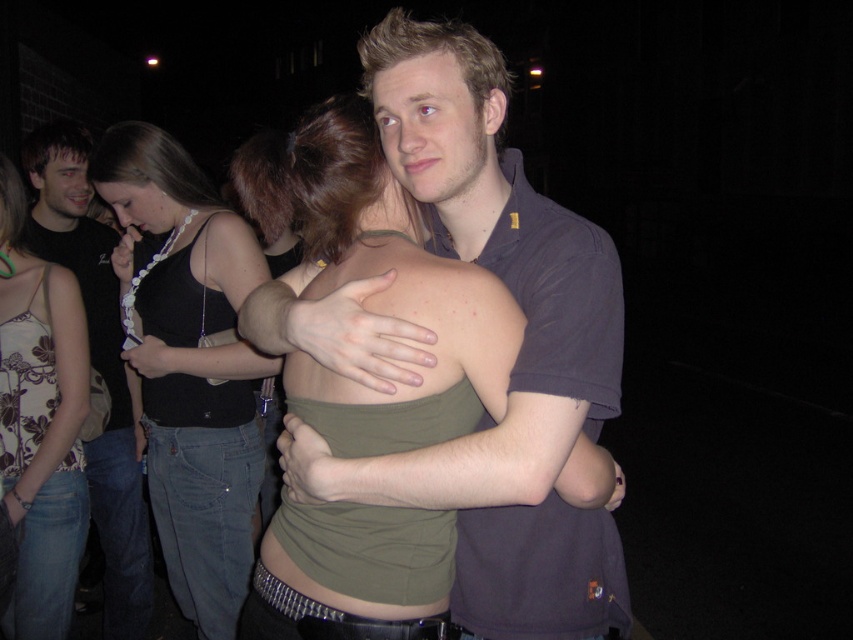
Question: From the image, what is the correct spatial relationship of floral print tank top at left in relation to matte black tank top at left?

Choices:
 (A) above
 (B) below

Answer: (A)

Question: Can you confirm if black fabric top at upper left is thinner than matte black tank top at left?

Choices:
 (A) no
 (B) yes

Answer: (A)

Question: Is floral print tank top at left thinner than matte black tank top at left?

Choices:
 (A) no
 (B) yes

Answer: (B)

Question: Which point is farther to the camera?

Choices:
 (A) (54, 170)
 (B) (137, 326)
 (C) (67, 609)
 (D) (312, 170)

Answer: (A)

Question: Which point appears closest to the camera in this image?

Choices:
 (A) (395, 401)
 (B) (247, 435)
 (C) (132, 595)

Answer: (A)

Question: Which point is closer to the camera taking this photo?

Choices:
 (A) (71, 484)
 (B) (412, 394)
 (C) (157, 387)
 (D) (119, 410)

Answer: (B)